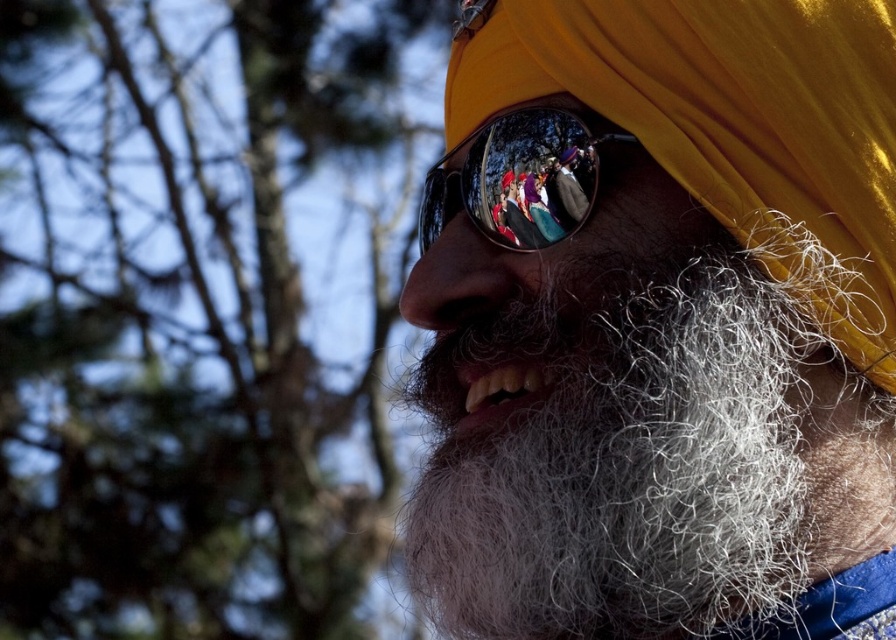
Is yellow matte turban at center wider than green leafy tree at upper left?

No, yellow matte turban at center is not wider than green leafy tree at upper left.

Is the position of yellow matte turban at center less distant than that of green leafy tree at upper left?

That is True.

Does point (791, 595) come in front of point (270, 40)?

Yes, point (791, 595) is in front of point (270, 40).

Find the location of a particular element. This screenshot has height=640, width=896. yellow matte turban at center is located at coordinates (660, 323).

Which is behind, point (161, 19) or point (444, 186)?

The point (161, 19) is more distant.

Measure the distance between green leafy tree at upper left and shiny reflective sunglasses at center.

green leafy tree at upper left and shiny reflective sunglasses at center are 1.88 meters apart from each other.

Does point (240, 189) come in front of point (524, 170)?

No, (240, 189) is further to viewer.

Image resolution: width=896 pixels, height=640 pixels. What are the coordinates of `green leafy tree at upper left` in the screenshot? It's located at (205, 310).

Does yellow matte turban at center have a greater width compared to shiny reflective sunglasses at center?

Correct, the width of yellow matte turban at center exceeds that of shiny reflective sunglasses at center.

How distant is yellow matte turban at center from shiny reflective sunglasses at center?

yellow matte turban at center is 4.43 inches away from shiny reflective sunglasses at center.

Find the location of a particular element. The image size is (896, 640). yellow matte turban at center is located at coordinates 660,323.